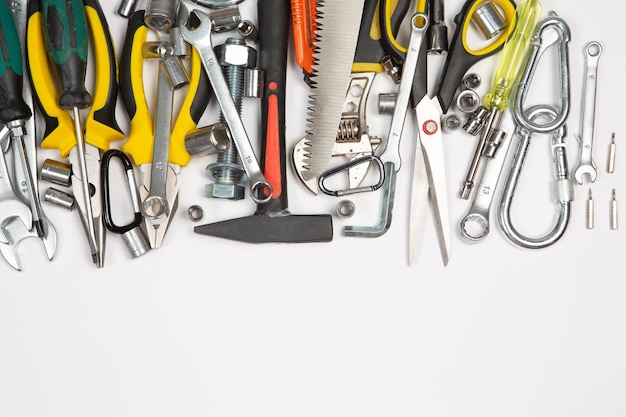
Locate an element on the screen. The width and height of the screenshot is (626, 417). small sockets is located at coordinates (471, 81), (453, 119), (491, 145), (340, 209), (195, 212), (48, 199), (247, 26).